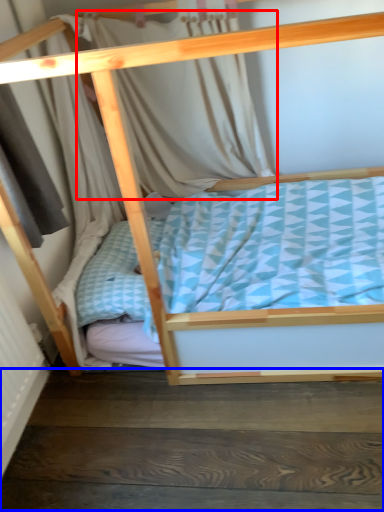
Question: Among these objects, which one is nearest to the camera, curtain (highlighted by a red box) or stair (highlighted by a blue box)?

Choices:
 (A) curtain
 (B) stair

Answer: (B)